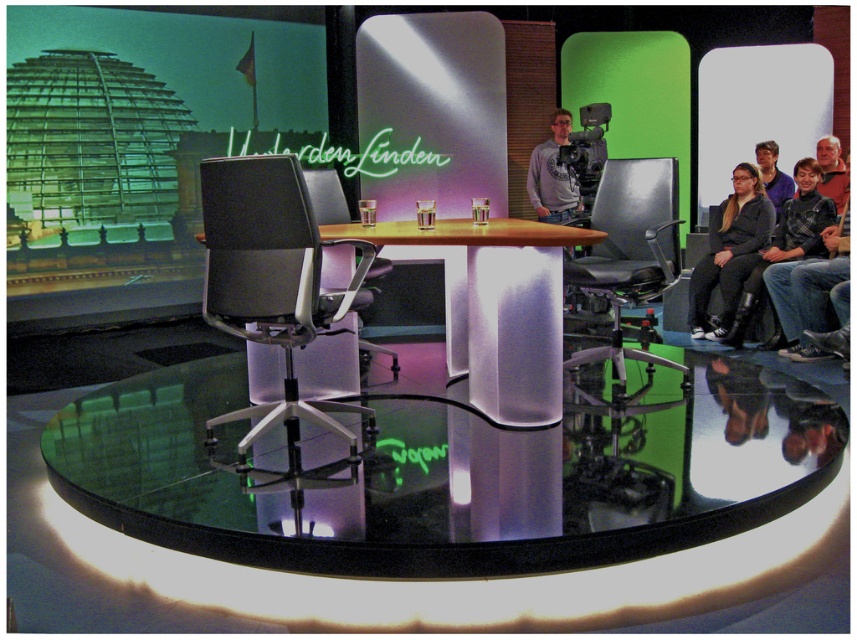
You are a stagehand carrying a 1.5 meter long ladder. You need to move it from the desk area to the background screen. Can you pass through the space between the transparent glass table at center and the black leather chair at center without tilting the ladder?

The distance between the transparent glass table at center and the black leather chair at center is 1.89 meters. Since the ladder is 1.5 meters long, it can fit through the space without tilting as the available space is wider than the ladder.

You are a guest speaker preparing to sit in one of the two chairs at the desk. You want to sit on the left side of the desk. Which chair should you choose between the matte black swivel chair at center and the black leather chair at center?

The matte black swivel chair at center is positioned on the right side of the black leather chair at center. To sit on the left side of the desk, you should choose the black leather chair at center since it is to the left of the other chair.

In the scene shown: You are a guest speaker preparing to join a panel discussion in the studio. You need to sit between the two chairs provided. Can you comfortably sit between the matte black swivel chair at center and the black leather chair at center without feeling cramped?

The matte black swivel chair at center and the black leather chair at center are 4.88 feet apart from each other. This distance is more than sufficient for a person to comfortably sit between them without feeling cramped.